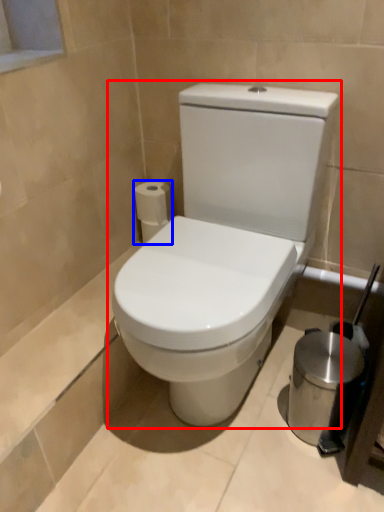
Question: Which object appears closest to the camera in this image, toilet (highlighted by a red box) or toilet paper (highlighted by a blue box)?

Choices:
 (A) toilet
 (B) toilet paper

Answer: (A)